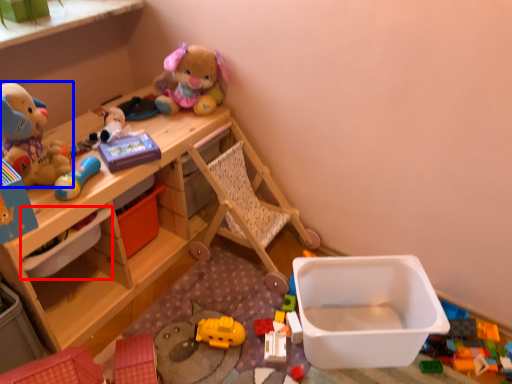
Question: Which object appears farthest to the camera in this image, storage box (highlighted by a red box) or toy (highlighted by a blue box)?

Choices:
 (A) storage box
 (B) toy

Answer: (A)